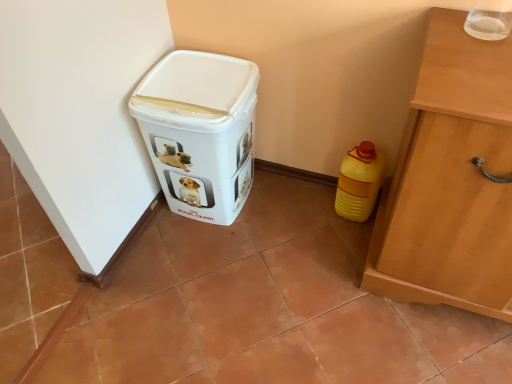
The height and width of the screenshot is (384, 512). I want to click on free spot in front of yellow plastic bottle at lower right, so click(x=344, y=238).